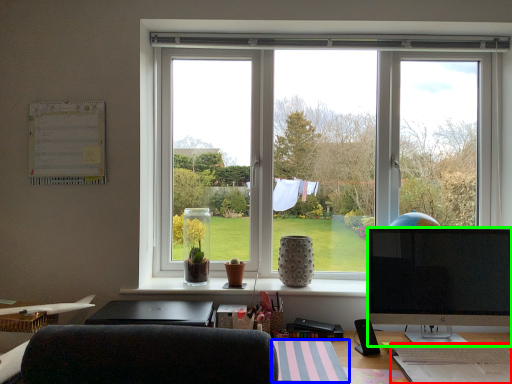
Question: Based on their relative distances, which object is farther from wide (highlighted by a red box)? Choose from notepad (highlighted by a blue box) and television (highlighted by a green box).

Choices:
 (A) notepad
 (B) television

Answer: (A)